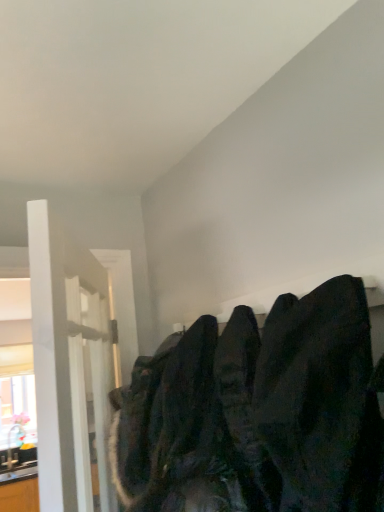
Question: From the image's perspective, is dark matte sweatshirt at upper right located beneath white glossy door at left?

Choices:
 (A) yes
 (B) no

Answer: (B)

Question: Is white glossy door at left located within dark matte sweatshirt at upper right?

Choices:
 (A) no
 (B) yes

Answer: (A)

Question: Does dark matte sweatshirt at upper right come in front of white glossy door at left?

Choices:
 (A) yes
 (B) no

Answer: (A)

Question: Considering the relative positions of dark matte sweatshirt at upper right and white glossy door at left in the image provided, is dark matte sweatshirt at upper right to the left of white glossy door at left from the viewer's perspective?

Choices:
 (A) yes
 (B) no

Answer: (B)

Question: Is there a large distance between dark matte sweatshirt at upper right and white glossy door at left?

Choices:
 (A) no
 (B) yes

Answer: (A)

Question: From the image's perspective, relative to dark fabric coat at upper right, is matte white window at left above or below?

Choices:
 (A) below
 (B) above

Answer: (A)

Question: Considering their positions, is matte white window at left located in front of or behind dark fabric coat at upper right?

Choices:
 (A) front
 (B) behind

Answer: (B)

Question: Based on their sizes in the image, would you say matte white window at left is bigger or smaller than dark fabric coat at upper right?

Choices:
 (A) small
 (B) big

Answer: (B)

Question: Considering the relative positions of matte white window at left and dark fabric coat at upper right in the image provided, is matte white window at left to the left or to the right of dark fabric coat at upper right?

Choices:
 (A) left
 (B) right

Answer: (A)

Question: From a real-world perspective, relative to white glossy door at left, is dark matte sweatshirt at upper right vertically above or below?

Choices:
 (A) below
 (B) above

Answer: (A)

Question: Is dark matte sweatshirt at upper right to the left or to the right of white glossy door at left in the image?

Choices:
 (A) left
 (B) right

Answer: (B)

Question: Considering the positions of dark matte sweatshirt at upper right and white glossy door at left in the image, is dark matte sweatshirt at upper right taller or shorter than white glossy door at left?

Choices:
 (A) short
 (B) tall

Answer: (A)

Question: Does point (135, 506) appear closer or farther from the camera than point (52, 442)?

Choices:
 (A) closer
 (B) farther

Answer: (B)

Question: From a real-world perspective, is dark fabric coat at upper right positioned above or below white glossy door at left?

Choices:
 (A) below
 (B) above

Answer: (A)

Question: Is dark fabric coat at upper right wider or thinner than white glossy door at left?

Choices:
 (A) wide
 (B) thin

Answer: (A)